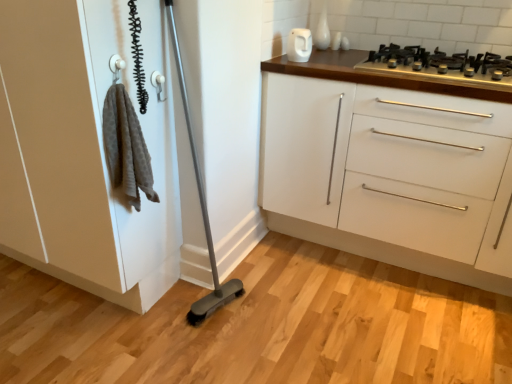
The height and width of the screenshot is (384, 512). I want to click on free spot to the right of white matte cabinet at left, so click(x=229, y=317).